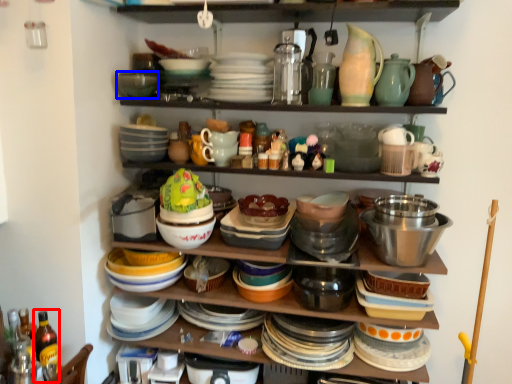
Question: Which point is further to the camera, bottle (highlighted by a red box) or bowl (highlighted by a blue box)?

Choices:
 (A) bottle
 (B) bowl

Answer: (B)